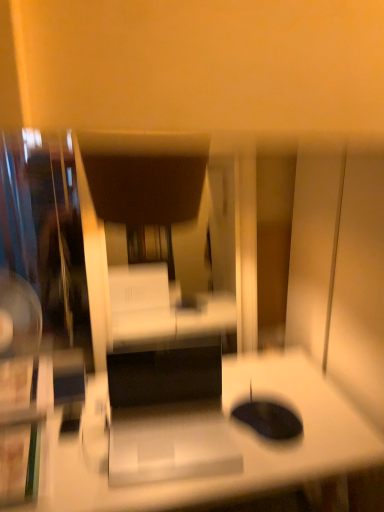
Locate an element on the screen. This screenshot has height=512, width=384. dark brown leather swivel chair at center is located at coordinates (140, 191).

What do you see at coordinates (140, 191) in the screenshot?
I see `dark brown leather swivel chair at center` at bounding box center [140, 191].

Measure the distance between white glossy desk at center and camera.

white glossy desk at center and camera are 3.57 feet apart from each other.

Where is `white glossy desk at center`? white glossy desk at center is located at coordinates (237, 440).

What do you see at coordinates (237, 440) in the screenshot? I see `white glossy desk at center` at bounding box center [237, 440].

Where is `dark brown leather swivel chair at center`? dark brown leather swivel chair at center is located at coordinates (140, 191).

Visually, is white glossy desk at center positioned to the left or to the right of dark brown leather swivel chair at center?

In the image, white glossy desk at center appears on the right side of dark brown leather swivel chair at center.

Relative to dark brown leather swivel chair at center, is white glossy desk at center in front or behind?

Clearly, white glossy desk at center is in front of dark brown leather swivel chair at center.

Is point (252, 469) in front of point (97, 177)?

Yes, it is in front of point (97, 177).

From the image's perspective, is white glossy desk at center positioned above or below dark brown leather swivel chair at center?

white glossy desk at center is below dark brown leather swivel chair at center.

From a real-world perspective, is white glossy desk at center positioned above or below dark brown leather swivel chair at center?

From a real-world perspective, white glossy desk at center is physically below dark brown leather swivel chair at center.

Does white glossy desk at center have a lesser width compared to dark brown leather swivel chair at center?

Incorrect, the width of white glossy desk at center is not less than that of dark brown leather swivel chair at center.

In terms of height, does white glossy desk at center look taller or shorter compared to dark brown leather swivel chair at center?

white glossy desk at center is taller than dark brown leather swivel chair at center.

Can you confirm if white glossy desk at center is smaller than dark brown leather swivel chair at center?

No, white glossy desk at center is not smaller than dark brown leather swivel chair at center.

Is white glossy desk at center spatially inside dark brown leather swivel chair at center, or outside of it?

white glossy desk at center is not inside dark brown leather swivel chair at center, it's outside.

Is there a large distance between white glossy desk at center and dark brown leather swivel chair at center?

white glossy desk at center is near dark brown leather swivel chair at center, not far away.

Is white glossy desk at center facing towards dark brown leather swivel chair at center?

No.

Can you tell me how much white glossy desk at center and dark brown leather swivel chair at center differ in facing direction?

There is a 4.37-degree angle between the facing directions of white glossy desk at center and dark brown leather swivel chair at center.

Identify the location of desk that is on the right side of dark brown leather swivel chair at center. (237, 440).

Which object is positioned more to the right, dark brown leather swivel chair at center or white glossy desk at center?

white glossy desk at center.

Is dark brown leather swivel chair at center in front of or behind white glossy desk at center in the image?

dark brown leather swivel chair at center is positioned farther from the viewer than white glossy desk at center.

Which point is more forward, (x=127, y=137) or (x=355, y=465)?

The point (x=127, y=137) is closer.

From the image's perspective, is dark brown leather swivel chair at center on white glossy desk at center?

Yes, from the image's perspective, dark brown leather swivel chair at center is on top of white glossy desk at center.

From a real-world perspective, is dark brown leather swivel chair at center located beneath white glossy desk at center?

Actually, dark brown leather swivel chair at center is physically above white glossy desk at center in the real world.

Which of these two, dark brown leather swivel chair at center or white glossy desk at center, is wider?

Wider between the two is white glossy desk at center.

From their relative heights in the image, would you say dark brown leather swivel chair at center is taller or shorter than white glossy desk at center?

Considering their sizes, dark brown leather swivel chair at center has less height than white glossy desk at center.

Can you confirm if dark brown leather swivel chair at center is smaller than white glossy desk at center?

Correct, dark brown leather swivel chair at center occupies less space than white glossy desk at center.

Can white glossy desk at center be found inside dark brown leather swivel chair at center?

No, white glossy desk at center is not a part of dark brown leather swivel chair at center.

Is dark brown leather swivel chair at center touching white glossy desk at center?

No, dark brown leather swivel chair at center is not next to white glossy desk at center.

Could you tell me if dark brown leather swivel chair at center is turned towards white glossy desk at center?

No, dark brown leather swivel chair at center is not turned towards white glossy desk at center.

How different are the orientations of dark brown leather swivel chair at center and white glossy desk at center in degrees?

They differ by 4.37 degrees in their facing directions.

At what (x,y) coordinates should I click in order to perform the action: click on swivel chair on the left of white glossy desk at center. Please return your answer as a coordinate pair (x, y). Looking at the image, I should click on (140, 191).

I want to click on swivel chair on the left of white glossy desk at center, so click(140, 191).

Where is `desk in front of the dark brown leather swivel chair at center`? desk in front of the dark brown leather swivel chair at center is located at coordinates (237, 440).